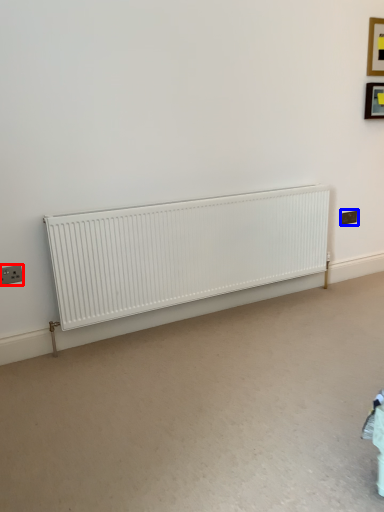
Question: Which point is further to the camera, electric outlet (highlighted by a red box) or electric outlet (highlighted by a blue box)?

Choices:
 (A) electric outlet
 (B) electric outlet

Answer: (B)